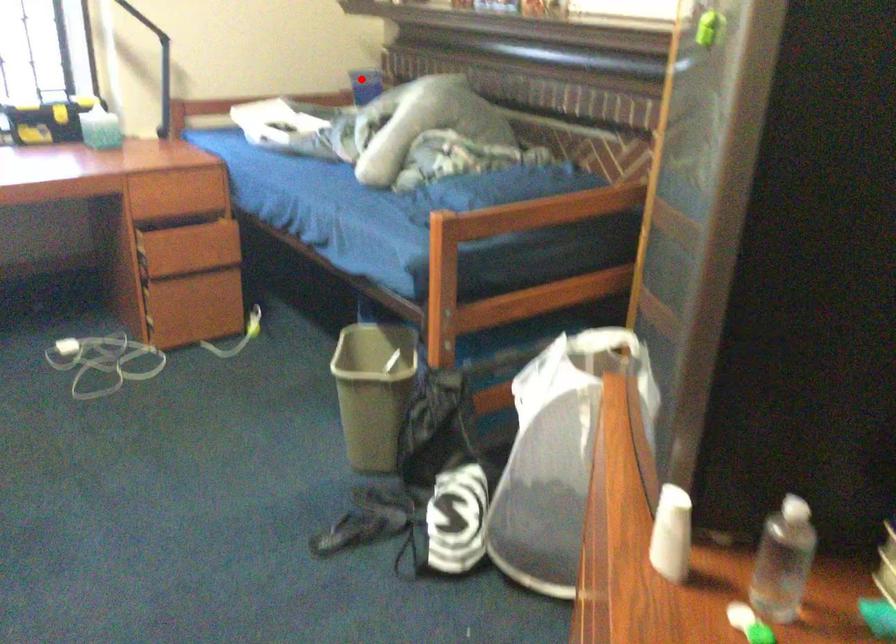
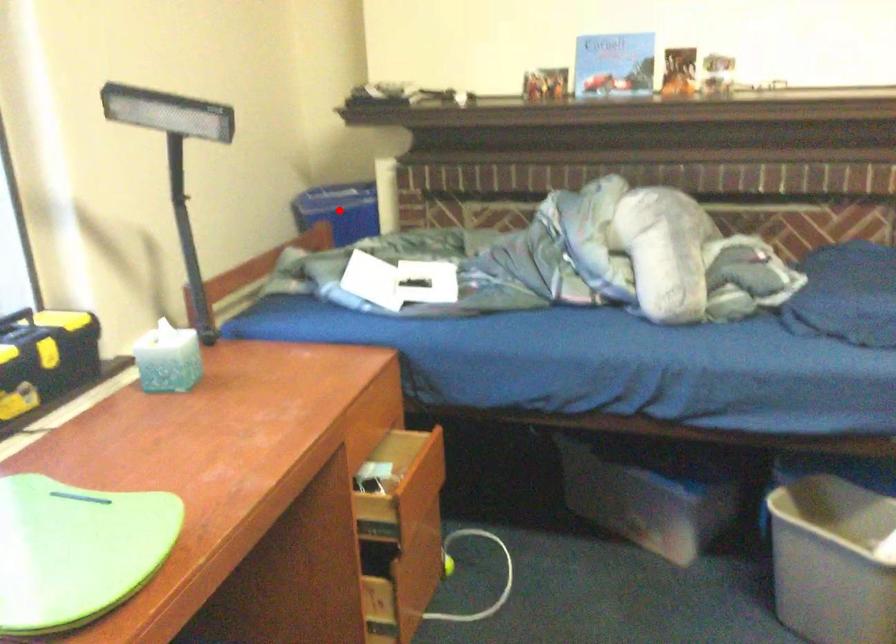
I am providing you with two images of the same scene from different viewpoints. A red point is marked on the first image and another point is marked on the second image. Is the marked point in image1 the same physical position as the marked point in image2?

Yes